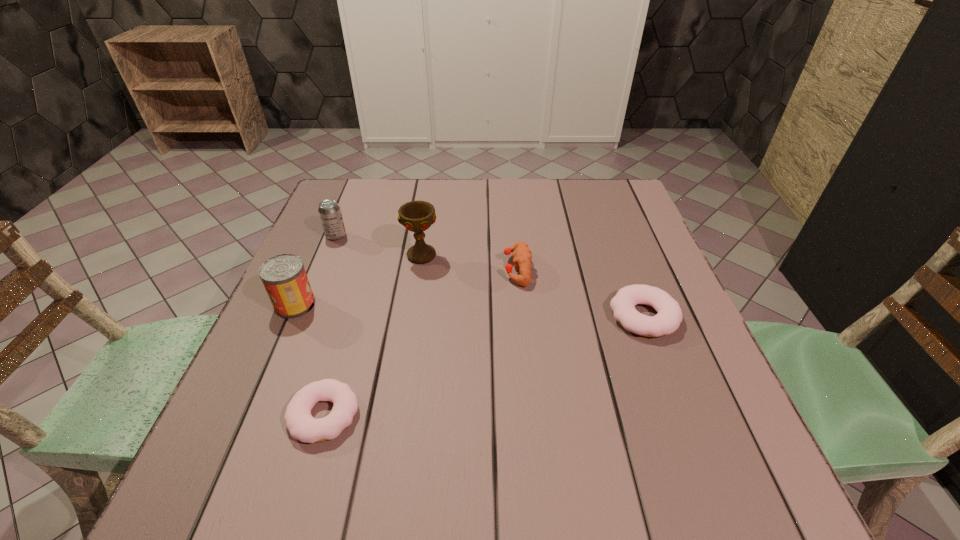
Please determine a free point for an extra doughnut to ensure balance. Please provide its 2D coordinates. Your answer should be formatted as a tuple, i.e. [(x, y)], where the tuple contains the x and y coordinates of a point satisfying the conditions above.

[(500, 360)]